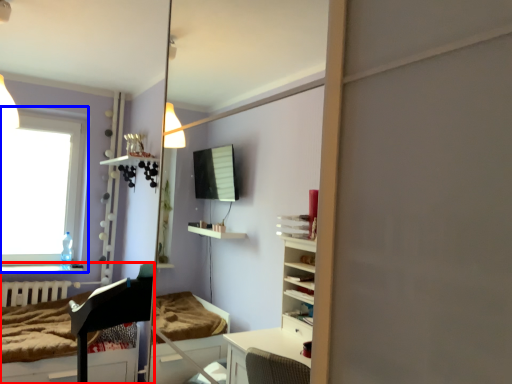
Question: Which object is further to the camera taking this photo, furniture (highlighted by a red box) or window (highlighted by a blue box)?

Choices:
 (A) furniture
 (B) window

Answer: (B)